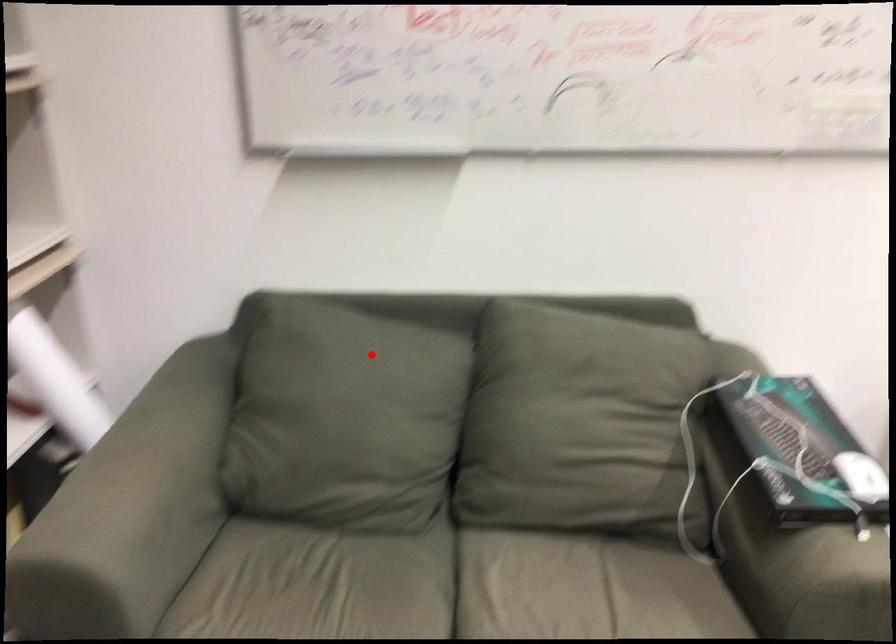
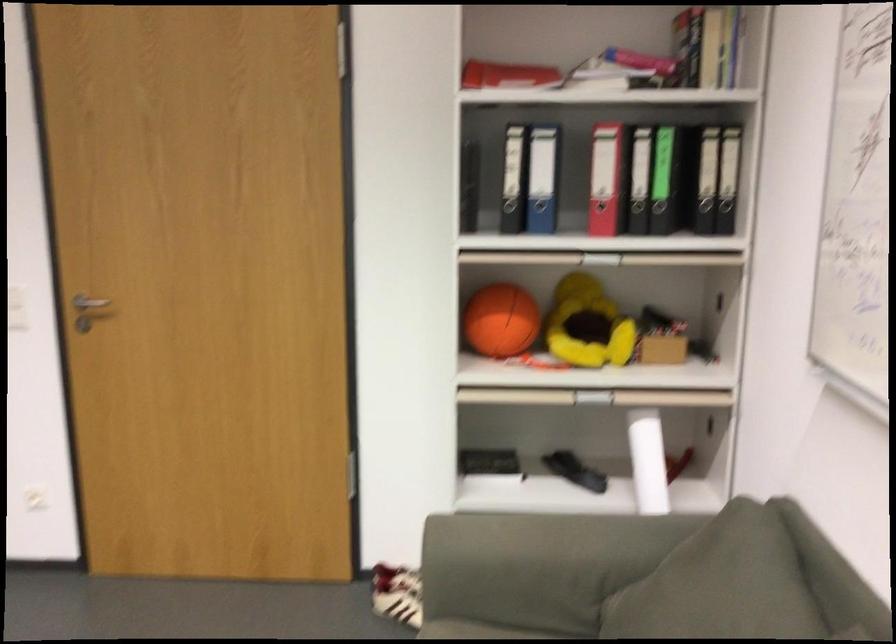
Question: I am providing you with two images of the same scene from different viewpoints. A red point is marked on the first image. At the location where the point appears in image 1, is it still visible in image 2?

Choices:
 (A) Yes
 (B) No

Answer: (A)